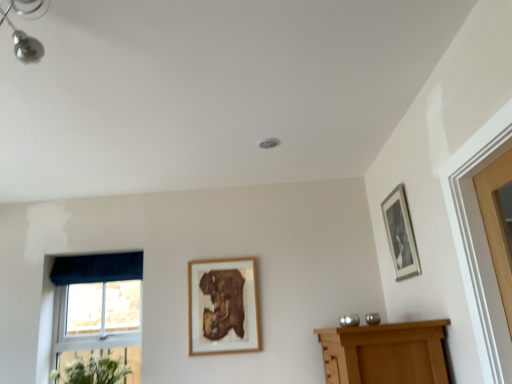
Question: From the image's perspective, is blue fabric window at lower left on wooden frame at center, which is counted as the 1th picture frame, starting from the left?

Choices:
 (A) yes
 (B) no

Answer: (B)

Question: Considering the relative sizes of blue fabric window at lower left and wooden frame at center, which is counted as the 1th picture frame, starting from the left, in the image provided, is blue fabric window at lower left smaller than wooden frame at center, which is counted as the 1th picture frame, starting from the left,?

Choices:
 (A) yes
 (B) no

Answer: (B)

Question: Is blue fabric window at lower left taller than wooden frame at center, acting as the first picture frame starting from the bottom?

Choices:
 (A) no
 (B) yes

Answer: (B)

Question: Does blue fabric window at lower left lie in front of wooden frame at center, which is counted as the 1th picture frame, starting from the left?

Choices:
 (A) no
 (B) yes

Answer: (A)

Question: Can you confirm if blue fabric window at lower left is thinner than wooden frame at center, acting as the first picture frame starting from the bottom?

Choices:
 (A) no
 (B) yes

Answer: (A)

Question: Considering the relative positions of blue fabric window at lower left and silver metallic picture frame at upper right, the first picture frame positioned from the top, in the image provided, is blue fabric window at lower left to the left or to the right of silver metallic picture frame at upper right, the first picture frame positioned from the top,?

Choices:
 (A) left
 (B) right

Answer: (A)

Question: In terms of size, does blue fabric window at lower left appear bigger or smaller than silver metallic picture frame at upper right, the second picture frame when ordered from back to front?

Choices:
 (A) big
 (B) small

Answer: (A)

Question: Is blue fabric window at lower left taller or shorter than silver metallic picture frame at upper right, the second picture frame when ordered from back to front?

Choices:
 (A) tall
 (B) short

Answer: (A)

Question: From a real-world perspective, is blue fabric window at lower left positioned above or below silver metallic picture frame at upper right, the first picture frame positioned from the top?

Choices:
 (A) above
 (B) below

Answer: (B)

Question: Is velvet dark blue curtain at left taller or shorter than white matte flowers at lower left?

Choices:
 (A) tall
 (B) short

Answer: (B)

Question: Visually, is velvet dark blue curtain at left positioned to the left or to the right of white matte flowers at lower left?

Choices:
 (A) left
 (B) right

Answer: (A)

Question: In the image, is velvet dark blue curtain at left positioned in front of or behind white matte flowers at lower left?

Choices:
 (A) front
 (B) behind

Answer: (B)

Question: Is velvet dark blue curtain at left bigger or smaller than white matte flowers at lower left?

Choices:
 (A) big
 (B) small

Answer: (B)

Question: Considering the positions of velvet dark blue curtain at left and wooden frame at center, which is counted as the 1th picture frame, starting from the left, in the image, is velvet dark blue curtain at left bigger or smaller than wooden frame at center, which is counted as the 1th picture frame, starting from the left,?

Choices:
 (A) big
 (B) small

Answer: (A)

Question: Considering the positions of velvet dark blue curtain at left and wooden frame at center, which is the second picture frame from right to left, in the image, is velvet dark blue curtain at left wider or thinner than wooden frame at center, which is the second picture frame from right to left,?

Choices:
 (A) thin
 (B) wide

Answer: (B)